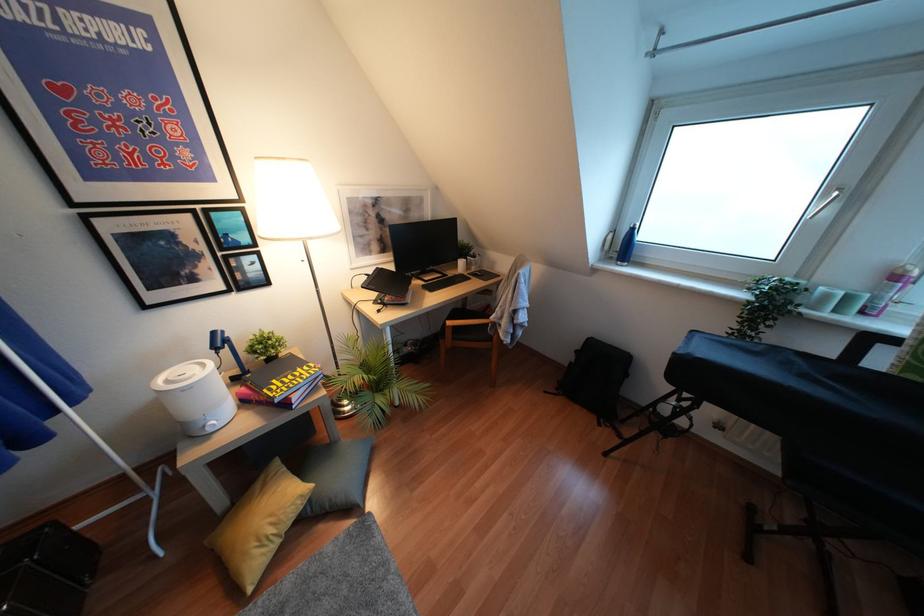
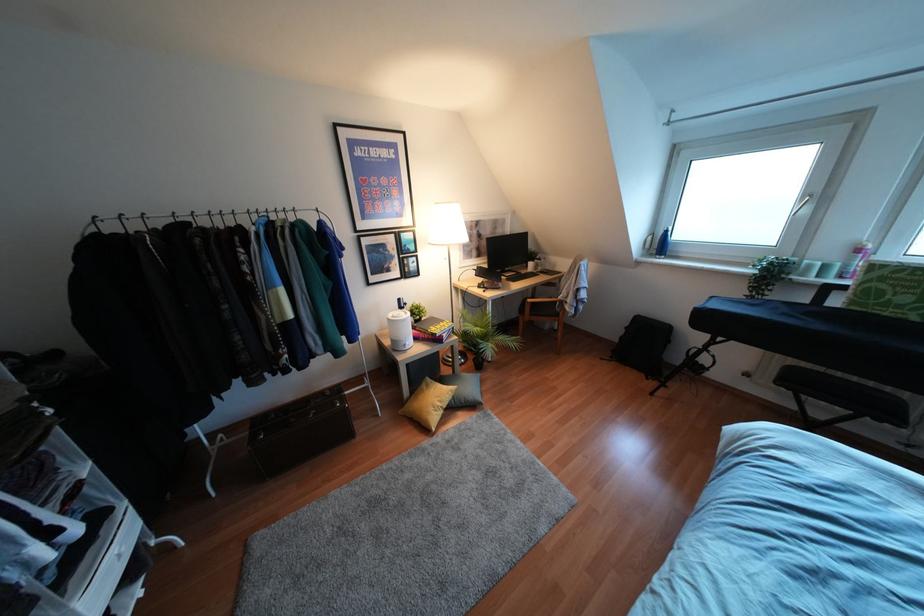
Locate, in the second image, the point that corresponds to pixel 623 246 in the first image.

(660, 245)